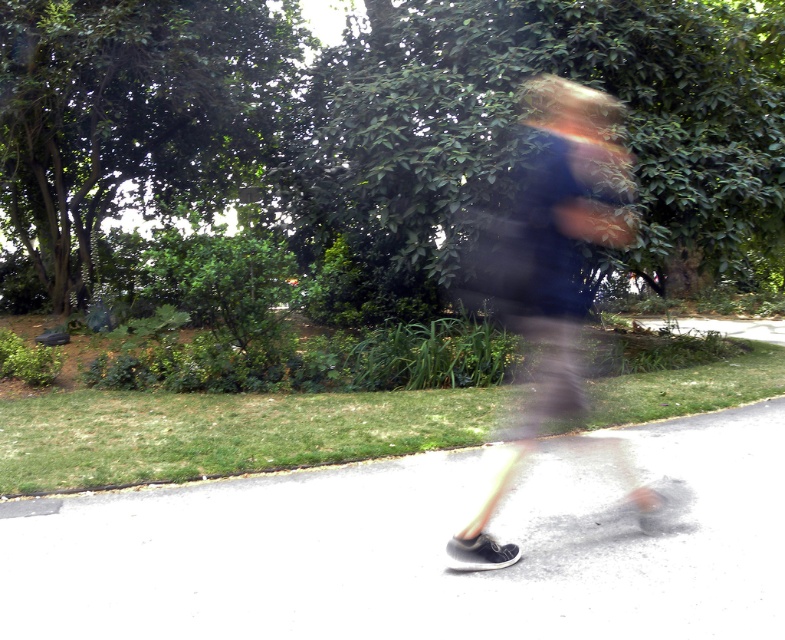
You are a photographer trying to capture the person running. You notice the white asphalt at center and the dark blue fabric at center in your frame. Which object takes up more space in the image?

The dark blue fabric at center takes up more space in the image because the white asphalt at center is smaller than the dark blue fabric at center.

You are a photographer trying to capture the runner in the image. You need to adjust your focus to ensure both the white asphalt at center and the dark blue fabric at center are in sharp detail. Which object should you focus on first to ensure the other is also in focus?

The white asphalt at center is to the left of dark blue fabric at center. Since they are positioned side by side horizontally, focusing on the middle point between them would ensure both are in focus. Alternatively, focusing on the closer object, which is the dark blue fabric at center, might keep both in focus if the depth of field is sufficient.

You are a photographer trying to capture the runner in the scene. You notice the white asphalt at center and the dark blue fabric at center. Which object should you focus on to ensure the runner is in sharp focus?

You should focus on the white asphalt at center because it is closer to the viewer than the dark blue fabric at center, ensuring the runner is in sharp focus.